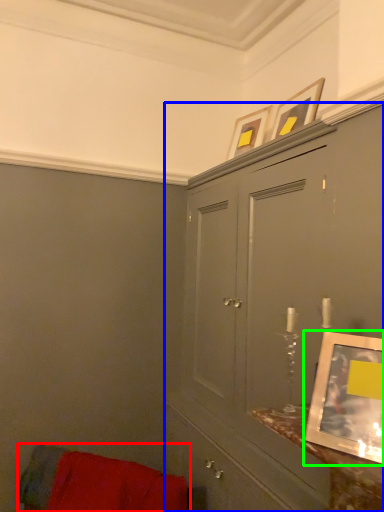
Question: Considering the real-world distances, which object is closest to furniture (highlighted by a red box)? cabinetry (highlighted by a blue box) or picture frame (highlighted by a green box).

Choices:
 (A) cabinetry
 (B) picture frame

Answer: (A)